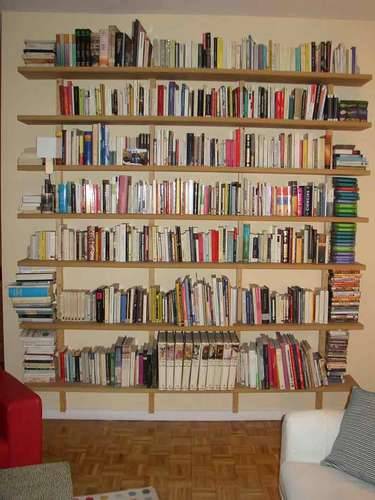
This screenshot has height=500, width=375. In order to click on stacks of books in this screenshot , I will do [x=212, y=290], [x=200, y=360], [x=198, y=244], [x=33, y=298], [x=194, y=97], [x=166, y=199], [x=238, y=149], [x=239, y=48].